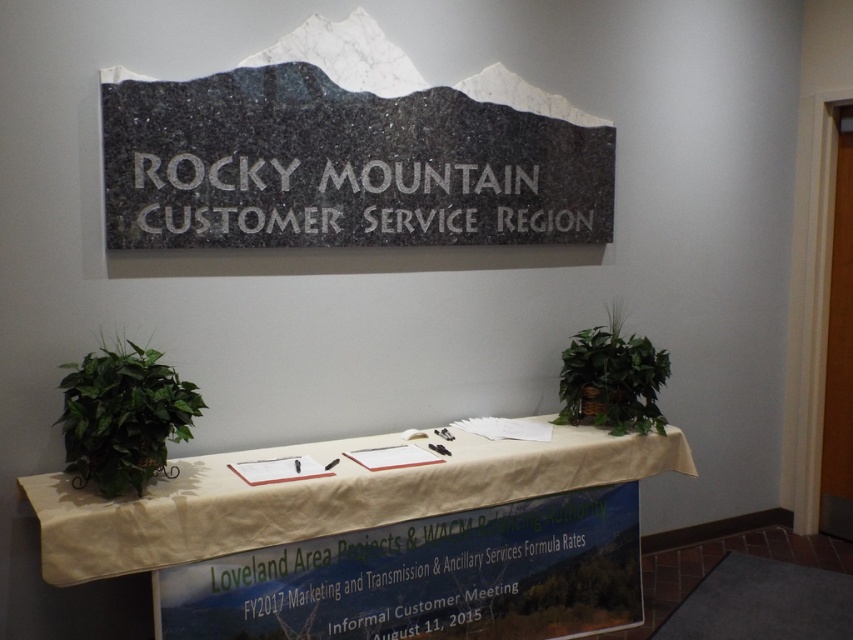
You are organizing a meeting in this room and need to place a new decorative item between the granite sign at center and the green leafy plant at center. Considering their sizes, which object should you place the new item closer to?

Since the granite sign at center is larger in size than the green leafy plant at center, you should place the new decorative item closer to the green leafy plant at center to balance the visual weight.